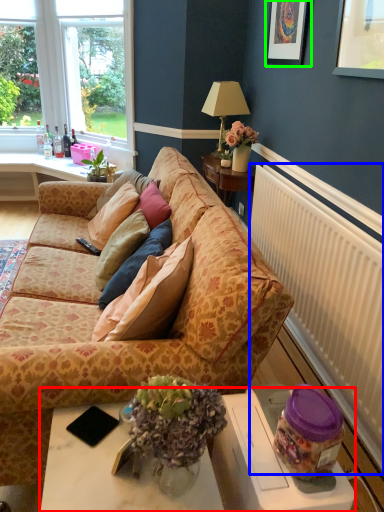
Question: Based on their relative distances, which object is farther from table (highlighted by a red box)? Choose from radiator (highlighted by a blue box) and picture frame (highlighted by a green box).

Choices:
 (A) radiator
 (B) picture frame

Answer: (B)